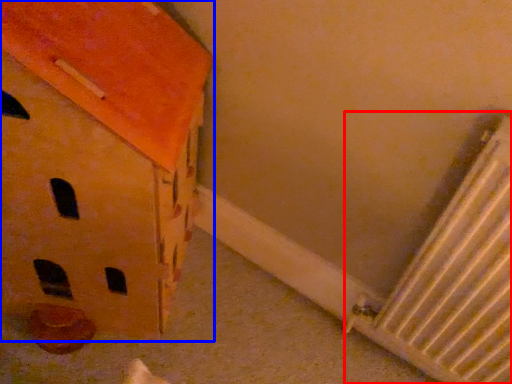
Question: Which object is further to the camera taking this photo, radiator (highlighted by a red box) or cardboard box (highlighted by a blue box)?

Choices:
 (A) radiator
 (B) cardboard box

Answer: (A)